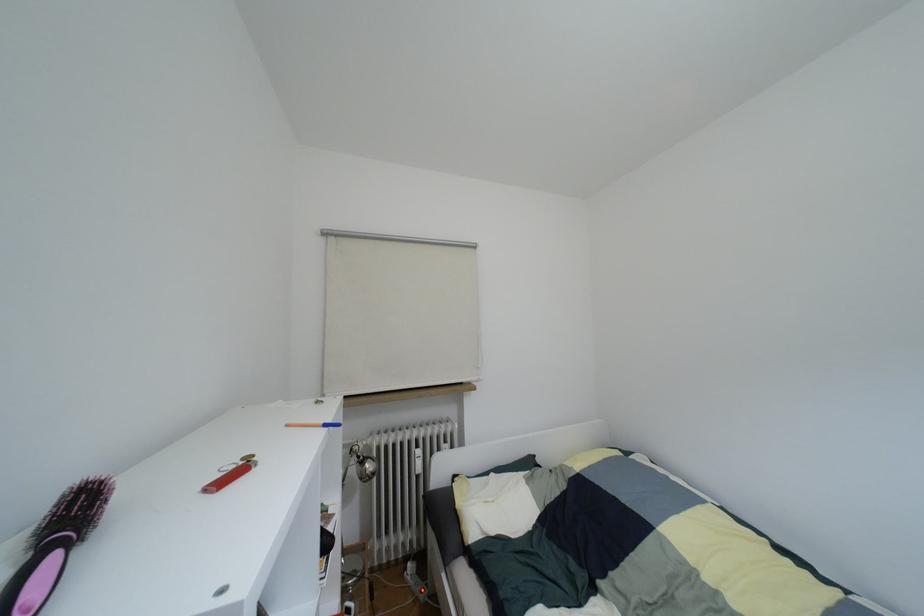
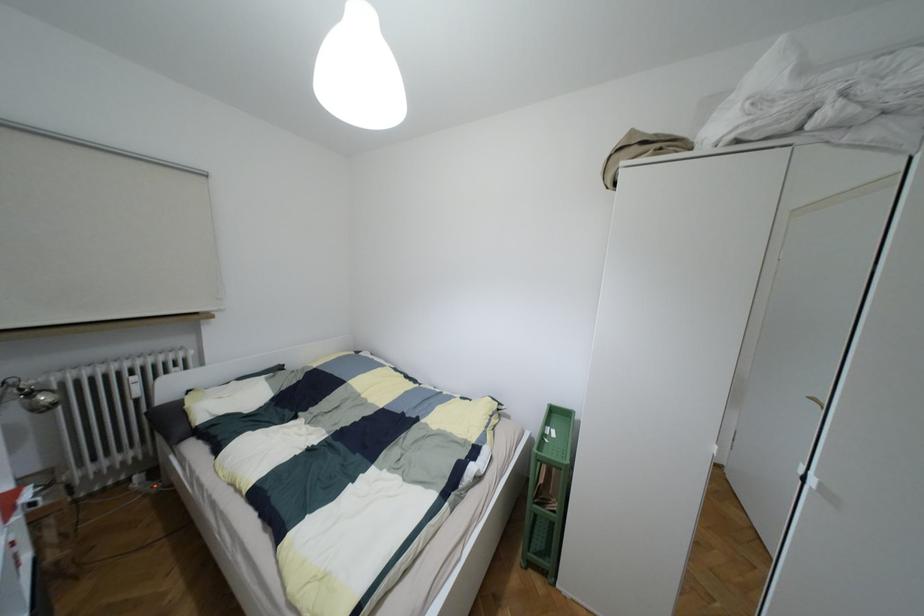
Question: The first image is from the beginning of the video and the second image is from the end. How did the camera likely rotate when shooting the video?

Choices:
 (A) Left
 (B) Right
 (C) Up
 (D) Down

Answer: (B)